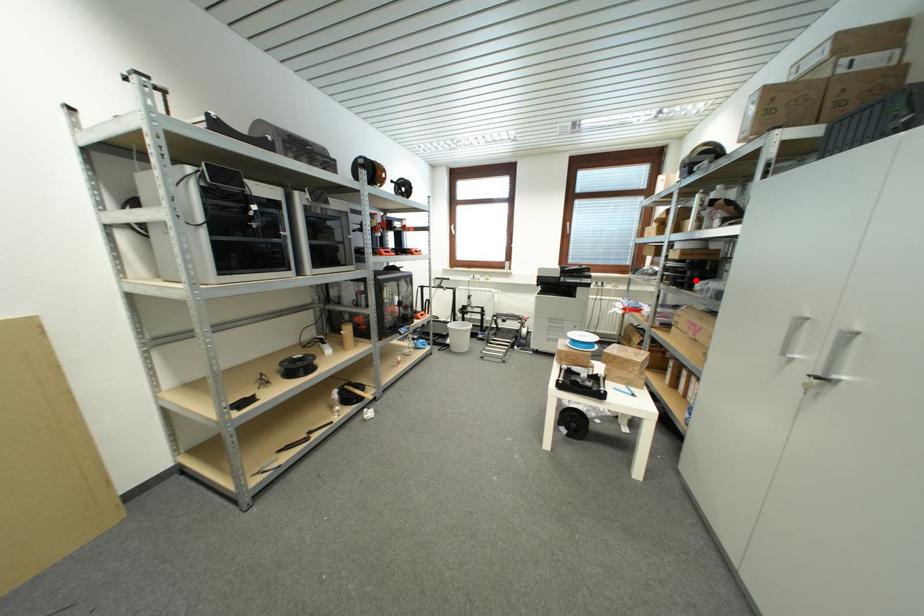
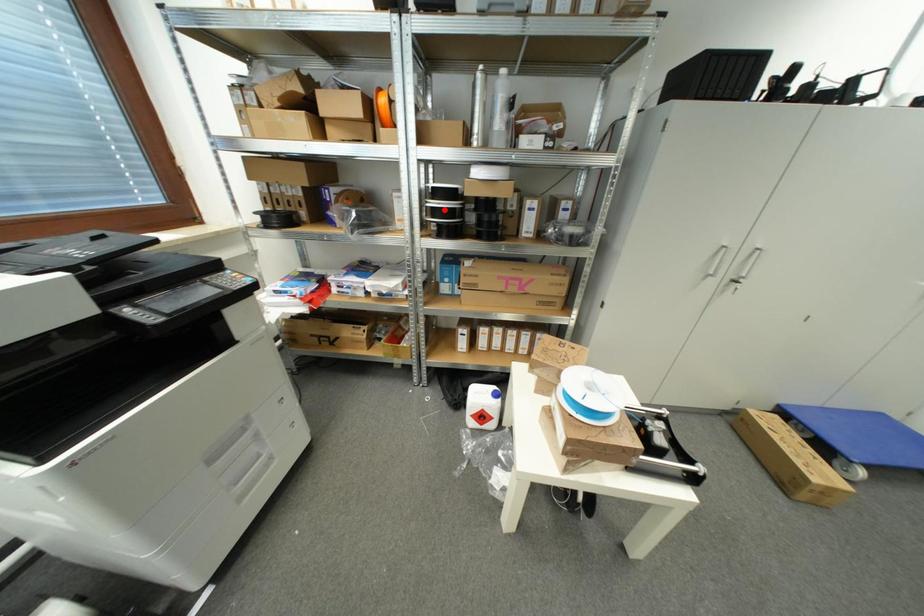
I am providing you with two images of the same scene from different viewpoints. A red point is marked on the first image and another point is marked on the second image. Is the red point in image1 aligned with the point shown in image2?

No